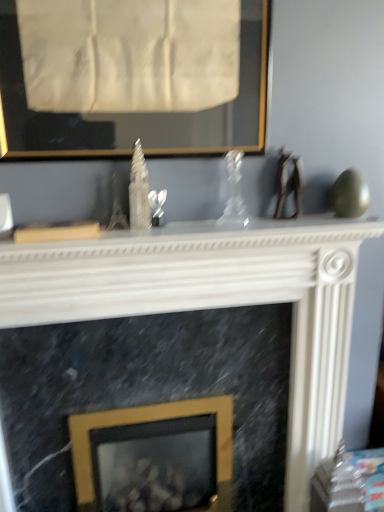
This screenshot has height=512, width=384. Find the location of `vacant area in front of transparent glass vase at center`. vacant area in front of transparent glass vase at center is located at coordinates 228,231.